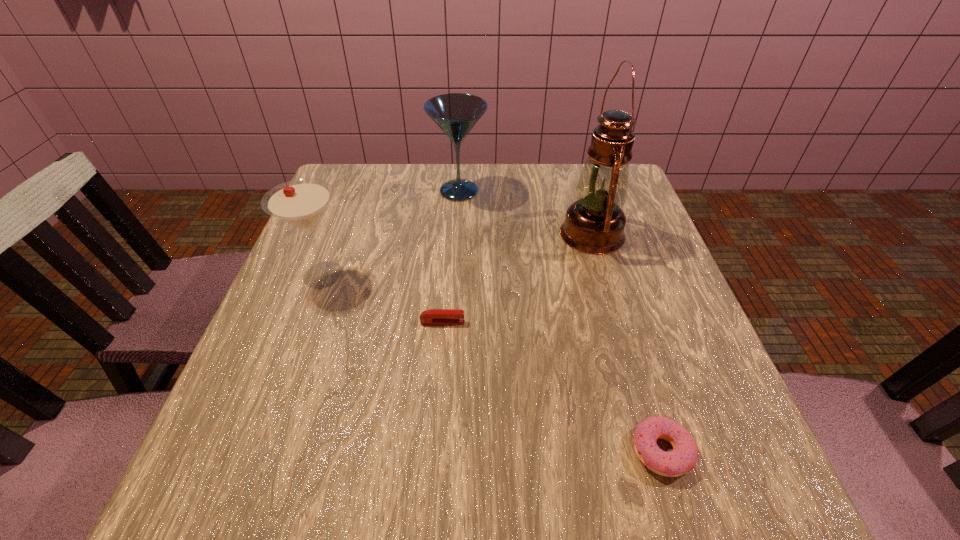
The image size is (960, 540). Find the location of `free space located on the left of the doughnut`. free space located on the left of the doughnut is located at coordinates (402, 451).

Identify the location of vacant space located on the front-facing side of the second nearest object. (541, 322).

Where is `oil lamp located at the far edge`? oil lamp located at the far edge is located at coordinates (594, 224).

Where is `martini that is positioned at the far edge`? martini that is positioned at the far edge is located at coordinates (456, 114).

The width and height of the screenshot is (960, 540). I want to click on object that is positioned at the near edge, so click(683, 457).

Where is `object that is at the left edge`? object that is at the left edge is located at coordinates (300, 203).

Identify the location of oil lamp that is at the right edge. The width and height of the screenshot is (960, 540). (594, 224).

Where is `doughnut located in the right edge section of the desktop`? doughnut located in the right edge section of the desktop is located at coordinates (683, 457).

Locate an element on the screen. The image size is (960, 540). object present at the far right corner is located at coordinates click(594, 224).

The image size is (960, 540). I want to click on object that is positioned at the near right corner, so click(x=683, y=457).